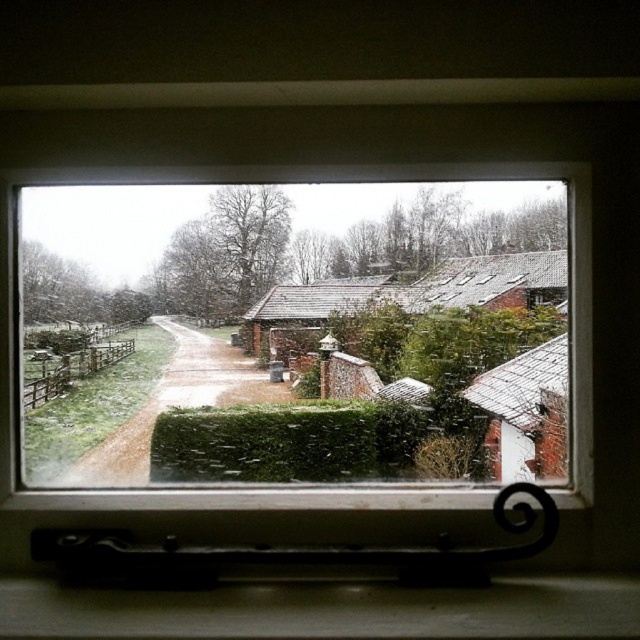
Between clear glass window at center and matte white sill at lower center, which one is positioned higher?

Positioned higher is clear glass window at center.

This screenshot has width=640, height=640. What do you see at coordinates (275, 326) in the screenshot?
I see `clear glass window at center` at bounding box center [275, 326].

You are a GUI agent. You are given a task and a screenshot of the screen. Output one action in this format:
    pyautogui.click(x=<x>, y=<y>)
    Task: Click on the clear glass window at center
    The height and width of the screenshot is (640, 640).
    Given the screenshot: What is the action you would take?
    pyautogui.click(x=275, y=326)